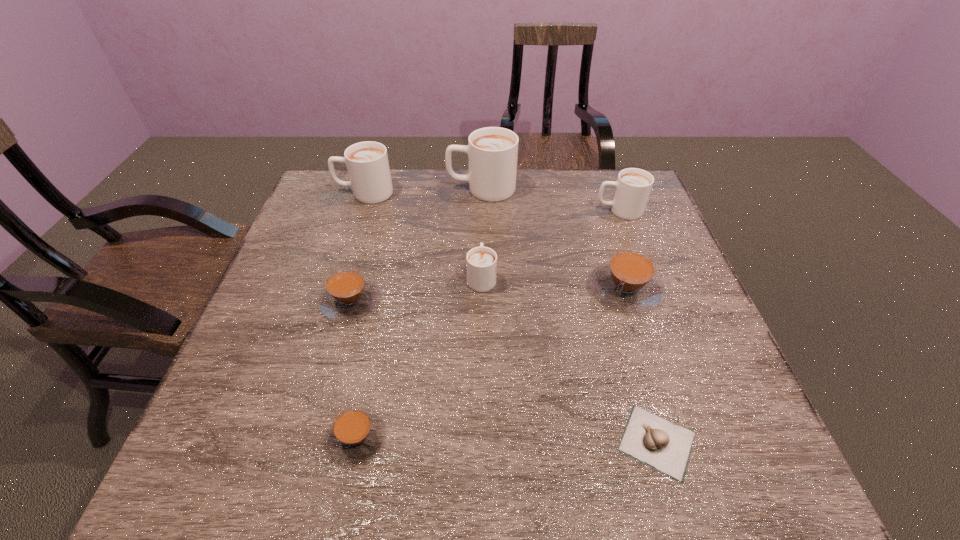
At what (x,y) coordinates should I click in order to perform the action: click on the biggest white cappuccino. Please return your answer as a coordinate pair (x, y). This screenshot has width=960, height=540. Looking at the image, I should click on (492, 152).

At what (x,y) coordinates should I click in order to perform the action: click on the tallest cappuccino. Please return your answer as a coordinate pair (x, y). Image resolution: width=960 pixels, height=540 pixels. Looking at the image, I should click on (492, 152).

Image resolution: width=960 pixels, height=540 pixels. Identify the location of the second tallest cappuccino. (367, 163).

Locate an element on the screen. This screenshot has width=960, height=540. the second tallest object is located at coordinates (367, 163).

At what (x,y) coordinates should I click in order to perform the action: click on the sixth shortest object. Please return your answer as a coordinate pair (x, y). This screenshot has height=540, width=960. Looking at the image, I should click on (633, 186).

You are a GUI agent. You are given a task and a screenshot of the screen. Output one action in this format:
    pyautogui.click(x=<x>, y=<y>)
    Task: Click on the rightmost white cappuccino
    The width and height of the screenshot is (960, 540).
    Given the screenshot: What is the action you would take?
    (x=633, y=186)

This screenshot has width=960, height=540. Find the location of `the biggest brown cappuccino`. the biggest brown cappuccino is located at coordinates (628, 281).

Where is `the nearest white cappuccino`? the nearest white cappuccino is located at coordinates tap(481, 261).

Where is `the second biggest brown cappuccino`? Image resolution: width=960 pixels, height=540 pixels. the second biggest brown cappuccino is located at coordinates (348, 295).

The width and height of the screenshot is (960, 540). I want to click on the nearest brown cappuccino, so click(356, 434).